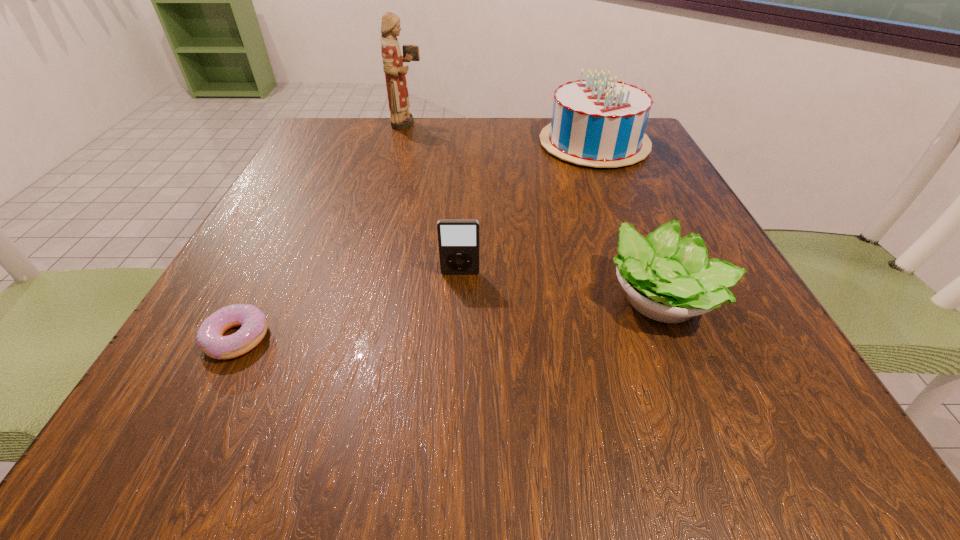
Where is `blank space at the left edge of the desktop`? This screenshot has width=960, height=540. blank space at the left edge of the desktop is located at coordinates (338, 187).

The width and height of the screenshot is (960, 540). In order to click on free space at the right edge of the desktop in this screenshot , I will do `click(656, 190)`.

In the image, there is a desktop. What are the coordinates of `vacant space at the far left corner` in the screenshot? It's located at (344, 156).

The width and height of the screenshot is (960, 540). I want to click on vacant space at the far right corner of the desktop, so click(650, 163).

In the image, there is a desktop. In order to click on vacant space at the near right corner in this screenshot , I will do `click(771, 416)`.

Find the location of `unoccupied position between the third object from right to left and the tallest object`. unoccupied position between the third object from right to left and the tallest object is located at coordinates (434, 198).

The height and width of the screenshot is (540, 960). In order to click on unoccupied position between the lettuce and the tallest object in this screenshot , I will do `click(535, 211)`.

Find the location of a particular element. This screenshot has height=540, width=960. vacant space that's between the iPod and the fourth shortest object is located at coordinates (527, 208).

In order to click on vacant space in between the lettuce and the leftmost object in this screenshot , I will do `click(449, 319)`.

This screenshot has width=960, height=540. I want to click on free space between the birthday cake and the lettuce, so click(x=628, y=221).